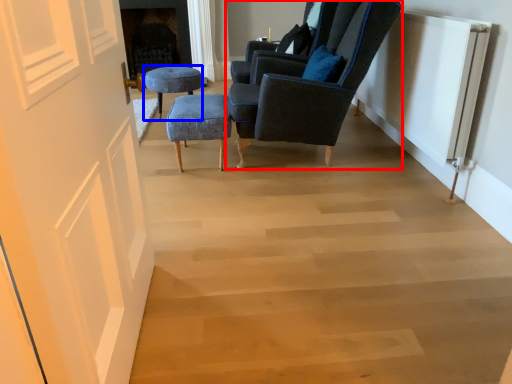
Question: Which point is closer to the camera, chair (highlighted by a red box) or stool (highlighted by a blue box)?

Choices:
 (A) chair
 (B) stool

Answer: (A)